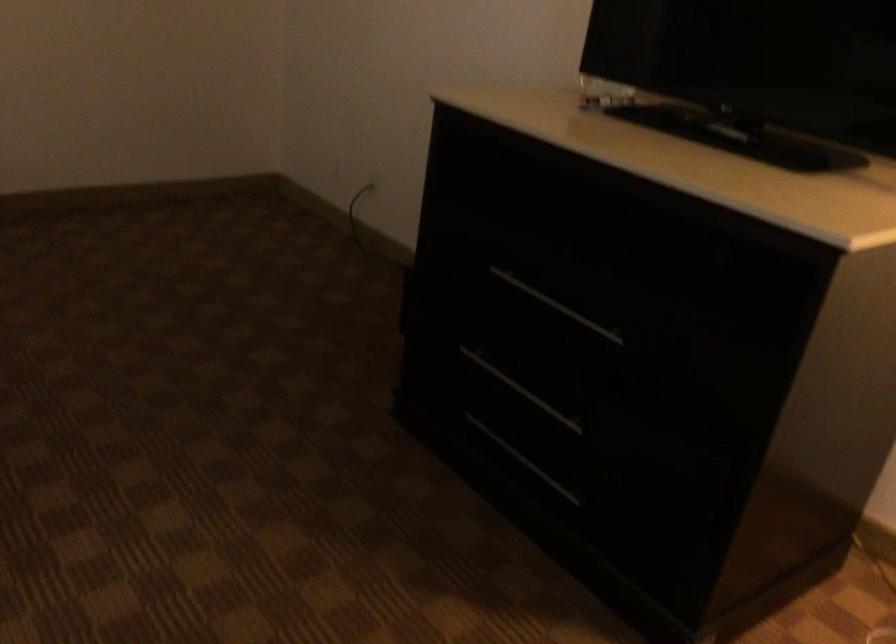
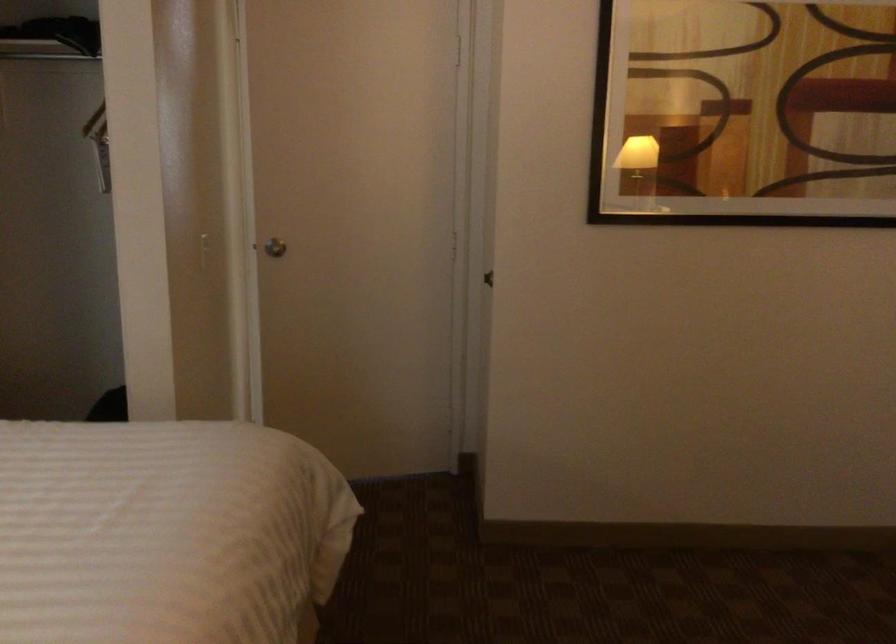
Question: The camera is either moving clockwise (left) or counter-clockwise (right) around the object. The first image is from the beginning of the video and the second image is from the end. Is the camera moving left or right when shooting the video?

Choices:
 (A) Left
 (B) Right

Answer: (B)